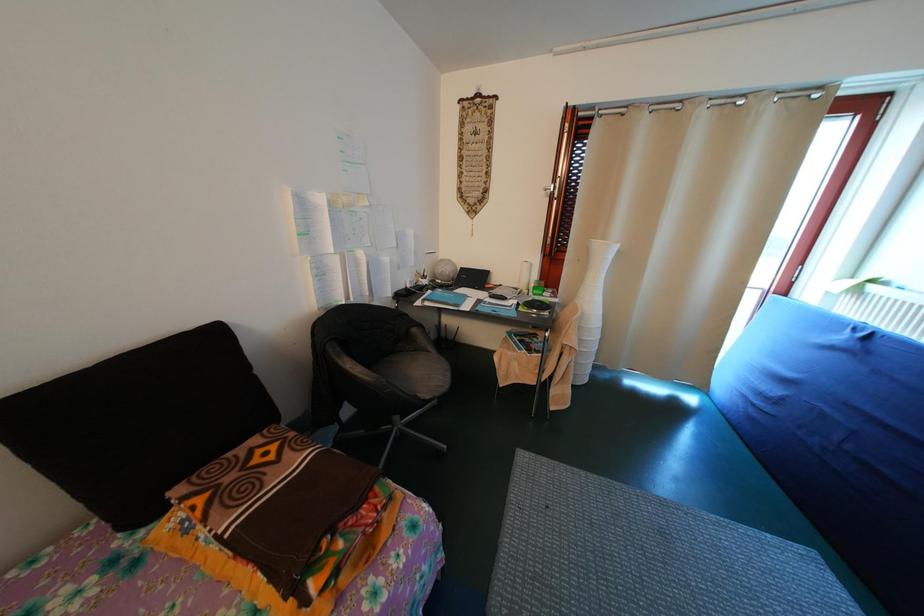
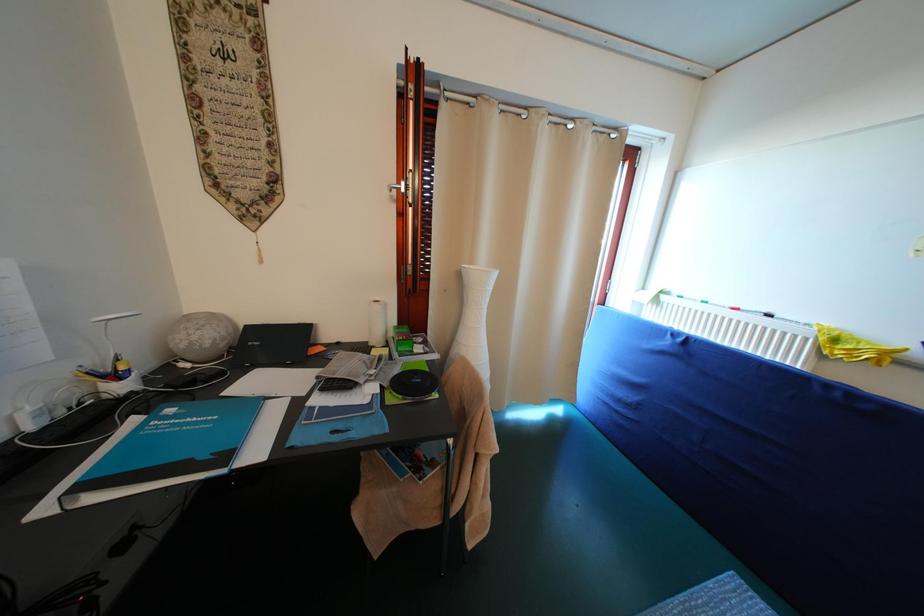
Question: The camera is either moving clockwise (left) or counter-clockwise (right) around the object. The first image is from the beginning of the video and the second image is from the end. Is the camera moving left or right when shooting the video?

Choices:
 (A) Left
 (B) Right

Answer: (A)